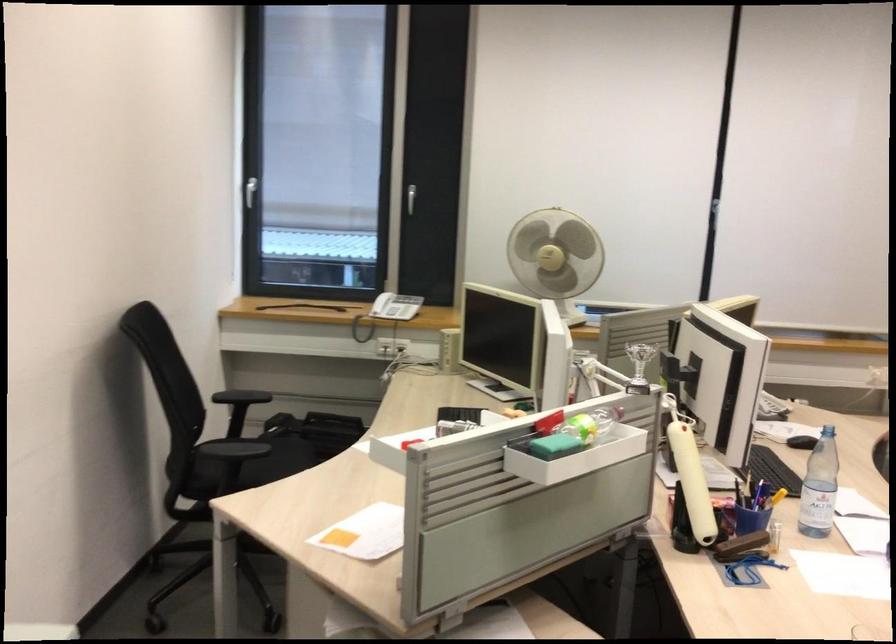
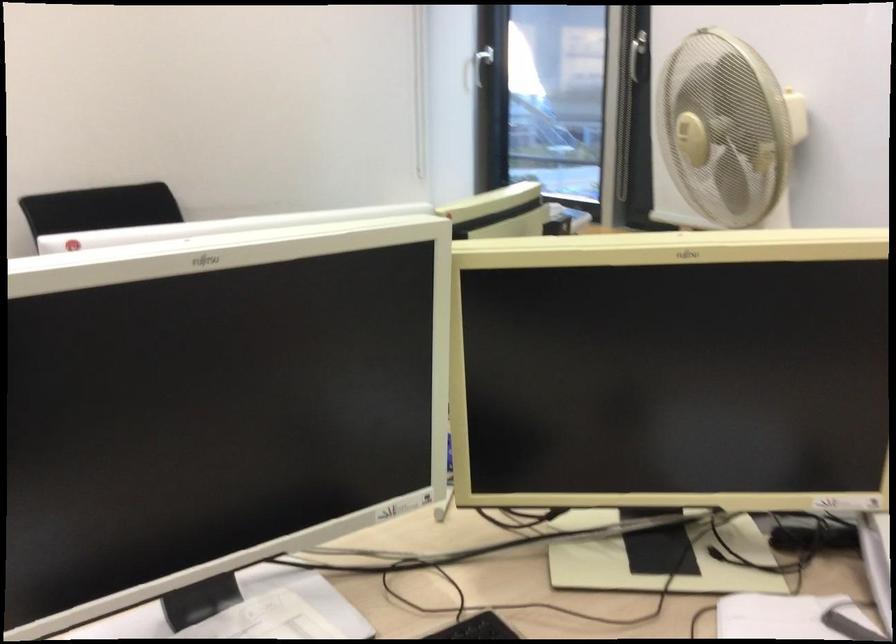
Where in the second image is the point corresponding to point (533, 241) from the first image?

(685, 129)